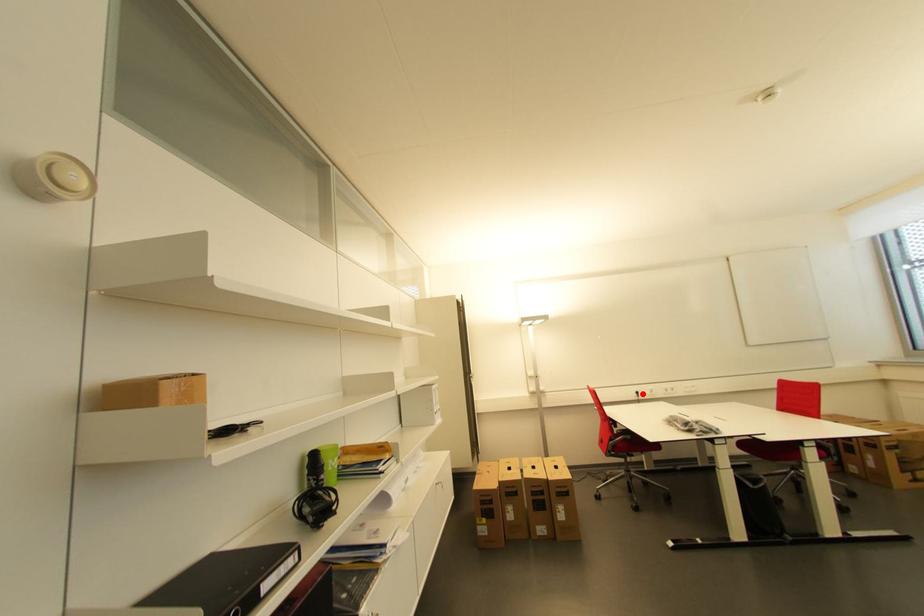
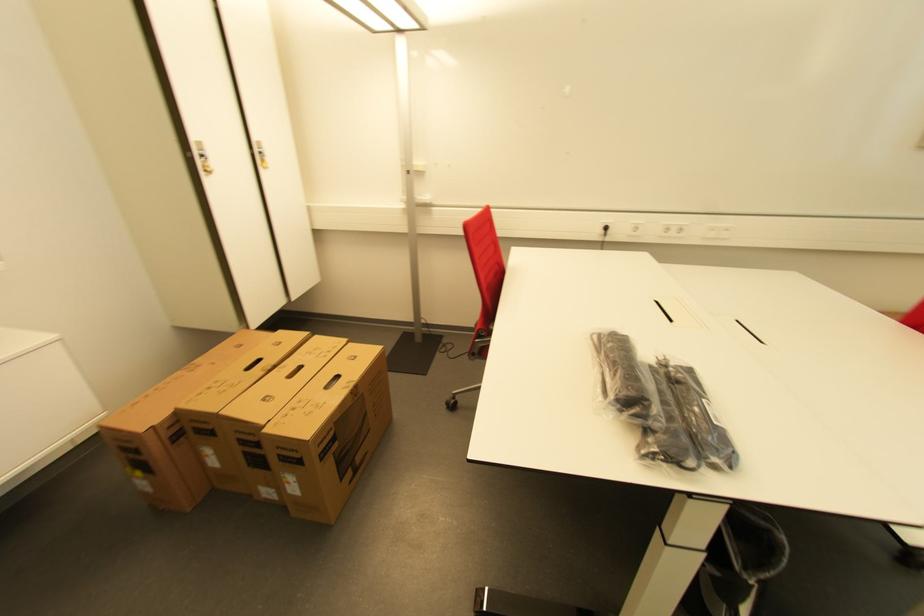
Question: I am providing you with two images of the same scene from different viewpoints. In image1, a red point is highlighted. Considering the same 3D point in image2, which of the following is correct?

Choices:
 (A) It is closer
 (B) It is farther

Answer: (A)